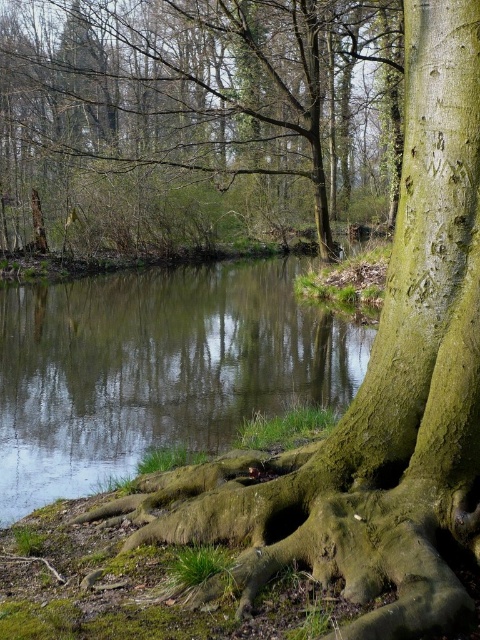
You are a hiker trying to cross the green mossy stream at center. The path you want to take is along the green mossy tree roots at lower left. Considering their widths, which one is wider?

The green mossy tree roots at lower left are wider than the green mossy stream at center.

You are standing in the natural scene and want to walk from the point at coordinates point (75, 109) to the point at coordinates point (137, 435). Which direction should you move to get closer to your destination?

Since point (75, 109) is further to the camera than point (137, 435), you should move forward towards the destination.

In the scene shown: You are standing in the forest and want to cross the green mossy stream at center. To do so, you need to step onto the green mossy tree roots at lower left. Can you reach the stream from there?

The green mossy tree roots at lower left are closer to you than the green mossy stream at center, so you can step onto them to reach the stream.